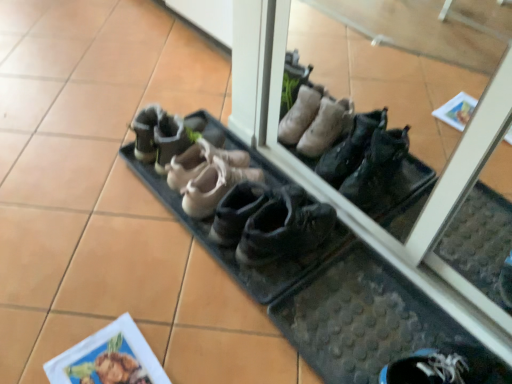
I want to click on empty space that is ontop of matte paper at lower left (from a real-world perspective), so click(111, 361).